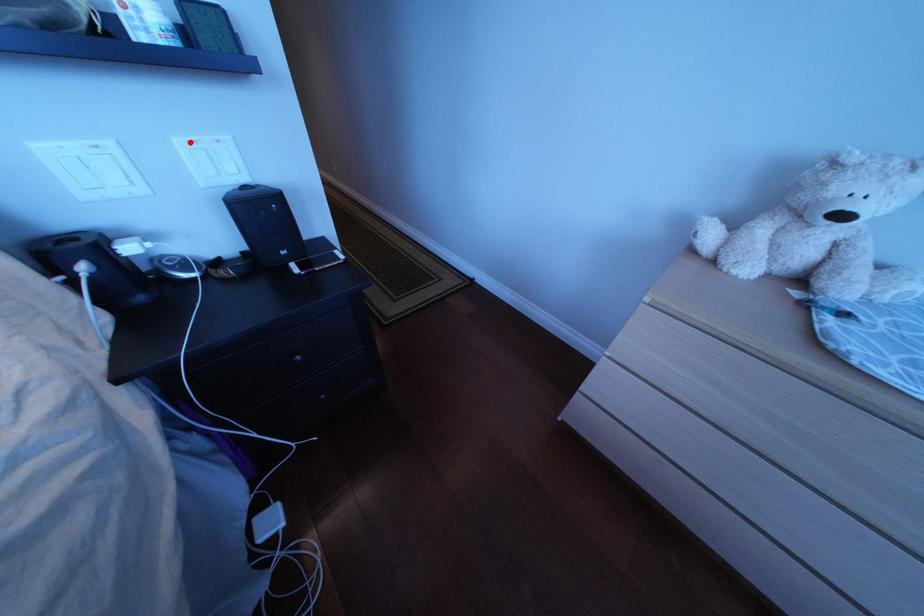
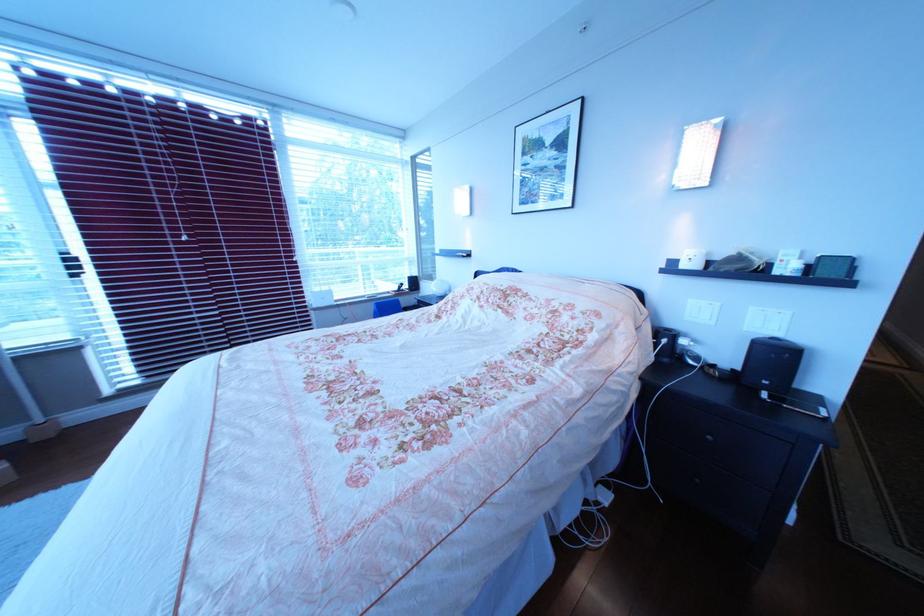
In the second image, find the point that corresponds to the highlighted location in the first image.

(767, 310)